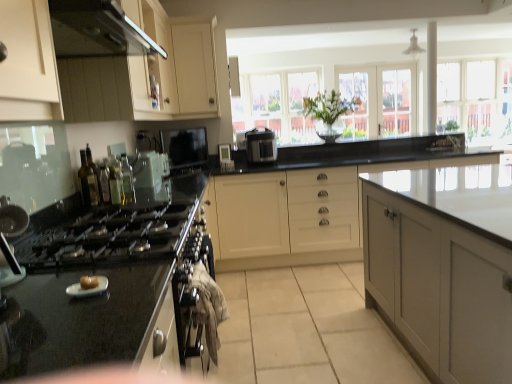
You are a GUI agent. You are given a task and a screenshot of the screen. Output one action in this format:
    pyautogui.click(x=<x>, y=<y>)
    Task: Click on the clear glass door at center, the 1th glass door in the right-to-left sequence
    
    Given the screenshot: What is the action you would take?
    pyautogui.click(x=381, y=98)

Describe the element at coordinates (381, 98) in the screenshot. I see `clear glass door at center, which is the 2th glass door from left to right` at that location.

In order to click on satin black exhaust hood at upper left in this screenshot , I will do `click(97, 30)`.

How much space does clear glass bottle at left, arranged as the second bottle when viewed from the back, occupy horizontally?

clear glass bottle at left, arranged as the second bottle when viewed from the back, is 6.15 centimeters in width.

Image resolution: width=512 pixels, height=384 pixels. What do you see at coordinates (277, 104) in the screenshot? I see `clear glass window at center, the second window screen positioned from the right` at bounding box center [277, 104].

The height and width of the screenshot is (384, 512). Identify the location of clear glass door at center, the 1th glass door in the right-to-left sequence. (381, 98).

From a real-world perspective, which is physically below, clear glass bottle at left, the 2th appliance from the top, or matte gold ring at lower left?

matte gold ring at lower left.

Are clear glass bottle at left, which is the first appliance from left to right, and matte gold ring at lower left far apart?

clear glass bottle at left, which is the first appliance from left to right, is actually quite close to matte gold ring at lower left.

Image resolution: width=512 pixels, height=384 pixels. I want to click on window that appears above the green glass bottle at left, the fourth bottle when ordered from back to front (from a real-world perspective), so click(476, 98).

Looking at the image, does clear glass window at upper right seem bigger or smaller compared to green glass bottle at left, the fourth bottle when ordered from back to front?

Considering their sizes, clear glass window at upper right takes up more space than green glass bottle at left, the fourth bottle when ordered from back to front.

From a real-world perspective, which object stands above the other?

clear glass window at upper right, from a real-world perspective.

Who is shorter, satin black rice cooker at center or satin black exhaust hood at upper left?

With less height is satin black exhaust hood at upper left.

Looking at this image, from a real-world perspective, between satin black rice cooker at center and satin black exhaust hood at upper left, who is vertically higher?

satin black exhaust hood at upper left is physically above.

Find the location of a particular element. exhaust hood lying on the left of satin black rice cooker at center is located at coordinates (97, 30).

Is satin black rice cooker at center not within satin black exhaust hood at upper left?

Absolutely, satin black rice cooker at center is external to satin black exhaust hood at upper left.

Where is `the 1st window screen above when counting from the white glossy digital clock at center, the 3th appliance positioned from the bottom (from the image's perspective)`? the 1st window screen above when counting from the white glossy digital clock at center, the 3th appliance positioned from the bottom (from the image's perspective) is located at coordinates (277, 104).

What's the angular difference between clear glass window at center, the second window screen positioned from the right, and white glossy digital clock at center, the 3th appliance positioned from the bottom,'s facing directions?

The facing directions of clear glass window at center, the second window screen positioned from the right, and white glossy digital clock at center, the 3th appliance positioned from the bottom, are 6.97 degrees apart.

Can you confirm if clear glass window at center, the second window screen positioned from the right, is bigger than white glossy digital clock at center, the 3th appliance in the front-to-back sequence?

Indeed, clear glass window at center, the second window screen positioned from the right, has a larger size compared to white glossy digital clock at center, the 3th appliance in the front-to-back sequence.

From the image's perspective, which object appears higher, clear glass window at center, marked as the 1th window screen in a left-to-right arrangement, or white glossy digital clock at center, marked as the 3th appliance in a left-to-right arrangement?

clear glass window at center, marked as the 1th window screen in a left-to-right arrangement, from the image's perspective.

Measure the distance from white glossy digital clock at center, the first appliance when ordered from top to bottom, to clear glass window at center, marked as the 1th window screen in a left-to-right arrangement.

white glossy digital clock at center, the first appliance when ordered from top to bottom, and clear glass window at center, marked as the 1th window screen in a left-to-right arrangement, are 2.88 meters apart.

From the image's perspective, is white glossy digital clock at center, acting as the first appliance starting from the back, over clear glass window at center, the second window screen positioned from the right?

Incorrect, from the image's perspective, white glossy digital clock at center, acting as the first appliance starting from the back, is lower than clear glass window at center, the second window screen positioned from the right.

Considering the positions of points (223, 165) and (285, 138), is point (223, 165) closer to camera compared to point (285, 138)?

Yes, point (223, 165) is closer to viewer.

Between white glossy digital clock at center, the first appliance when ordered from top to bottom, and clear glass window at center, the second window screen positioned from the right, which one appears on the right side from the viewer's perspective?

Positioned to the right is clear glass window at center, the second window screen positioned from the right.

How many degrees apart are the facing directions of satin black exhaust hood at upper left and clear glass bottle at left, which ranks as the 3th bottle in front-to-back order?

The angular difference between satin black exhaust hood at upper left and clear glass bottle at left, which ranks as the 3th bottle in front-to-back order, is 1.2 degrees.

Considering the positions of objects satin black exhaust hood at upper left and clear glass bottle at left, which ranks as the 3th bottle in front-to-back order, in the image provided, who is in front, satin black exhaust hood at upper left or clear glass bottle at left, which ranks as the 3th bottle in front-to-back order,?

satin black exhaust hood at upper left is more forward.

From a real-world perspective, which is physically below, satin black exhaust hood at upper left or clear glass bottle at left, which ranks as the 3th bottle in front-to-back order?

In real-world perspective, clear glass bottle at left, which ranks as the 3th bottle in front-to-back order, is lower.

Is satin black exhaust hood at upper left not near clear glass bottle at left, which ranks as the 3th bottle in front-to-back order?

They are positioned close to each other.

Is matte black sink at left, the 3th appliance viewed from the top, looking in the opposite direction of black glossy stovetop at left?

matte black sink at left, the 3th appliance viewed from the top, is not turned away from black glossy stovetop at left.

Is matte black sink at left, acting as the 2th appliance starting from the left, directly adjacent to black glossy stovetop at left?

No, matte black sink at left, acting as the 2th appliance starting from the left, is not next to black glossy stovetop at left.

Between point (5, 230) and point (148, 206), which one is positioned behind?

The point (148, 206) is farther from the camera.

Would you say matte black sink at left, the 3th appliance viewed from the top, is outside black glossy stovetop at left?

Absolutely, matte black sink at left, the 3th appliance viewed from the top, is external to black glossy stovetop at left.

The image size is (512, 384). I want to click on appliance that is the 2nd one when counting leftward from the matte gold ring at lower left, so click(x=147, y=169).

This screenshot has height=384, width=512. I want to click on window behind the green glass bottle at left, the fourth bottle when ordered from back to front, so (476, 98).

Based on their spatial positions, is translucent glass bottles at left, which is the 4th bottle from front to back, or clear glass bottle at left, which ranks as the 3th bottle in front-to-back order, closer to clear glass bottle at left, the 2th appliance from the top?

translucent glass bottles at left, which is the 4th bottle from front to back, is closer to clear glass bottle at left, the 2th appliance from the top.

From the image, which object appears to be nearer to clear glass door at upper center, which is counted as the second glass door, starting from the right, matte gold ring at lower left or white glossy digital clock at center, the 1th appliance viewed from the right?

white glossy digital clock at center, the 1th appliance viewed from the right, is positioned closer to the anchor clear glass door at upper center, which is counted as the second glass door, starting from the right.

Based on the photo, which object lies nearer to the anchor point green glass bottle at left, which ranks as the 3th bottle in back-to-front order, clear glass window at upper center, which appears as the 2th window screen when viewed from the left, or clear glass door at center, the 1th glass door in the right-to-left sequence?

clear glass door at center, the 1th glass door in the right-to-left sequence, is closer to green glass bottle at left, which ranks as the 3th bottle in back-to-front order.

Looking at the image, which one is located further to clear glass window at upper right, clear glass window at upper center, which is counted as the first window screen, starting from the right, or clear glass window at center, the second window screen positioned from the right?

clear glass window at center, the second window screen positioned from the right, lies further to clear glass window at upper right than the other object.

Based on their spatial positions, is black granite countertop at center or matte gold ring at lower left closer to white glossy digital clock at center, the 3th appliance in the front-to-back sequence?

black granite countertop at center lies closer to white glossy digital clock at center, the 3th appliance in the front-to-back sequence, than the other object.

Looking at the image, which one is located closer to matte black oven at center, matte black sink at left, placed as the 1th appliance when sorted from bottom to top, or clear glass bottle at left, which ranks as the 3th bottle in front-to-back order?

clear glass bottle at left, which ranks as the 3th bottle in front-to-back order, is positioned closer to the anchor matte black oven at center.

Looking at the image, which one is located further to clear glass bottle at left, which is the 2th appliance from back to front, satin black rice cooker at center or matte cream cabinet at upper center?

satin black rice cooker at center lies further to clear glass bottle at left, which is the 2th appliance from back to front, than the other object.

Looking at the image, which one is located closer to matte gold ring at lower left, translucent glass bottles at left, which is the 1th bottle in back-to-front order, or clear glass bottle at left, which is the first appliance from left to right?

Based on the image, translucent glass bottles at left, which is the 1th bottle in back-to-front order, appears to be nearer to matte gold ring at lower left.

At what (x,y) coordinates should I click in order to perform the action: click on counter between matte black sink at left, the 3th appliance positioned from the back, and clear glass window at upper center, which appears as the 2th window screen when viewed from the left, along the z-axis. Please return your answer as a coordinate pair (x, y). This screenshot has width=512, height=384. Looking at the image, I should click on (301, 197).

At what (x,y) coordinates should I click in order to perform the action: click on oven positioned between black granite countertop at center and clear glass door at center, which is the 2th glass door from left to right, from near to far. Please return your answer as a coordinate pair (x, y). The width and height of the screenshot is (512, 384). Looking at the image, I should click on (185, 147).

Identify the location of cabinetry located between green glass bottle at left, which is the 2th bottle in front-to-back order, and clear glass window at center, marked as the 1th window screen in a left-to-right arrangement, in the depth direction. (195, 68).

I want to click on kitchen appliance between green glass bottle at left, which ranks as the 3th bottle in back-to-front order, and clear glass door at upper center, which is counted as the second glass door, starting from the right, along the z-axis, so click(x=261, y=146).